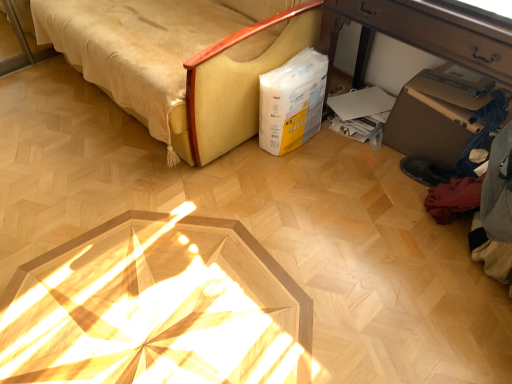
Image resolution: width=512 pixels, height=384 pixels. I want to click on free space in front of beige fabric sofa at upper left, so click(x=192, y=235).